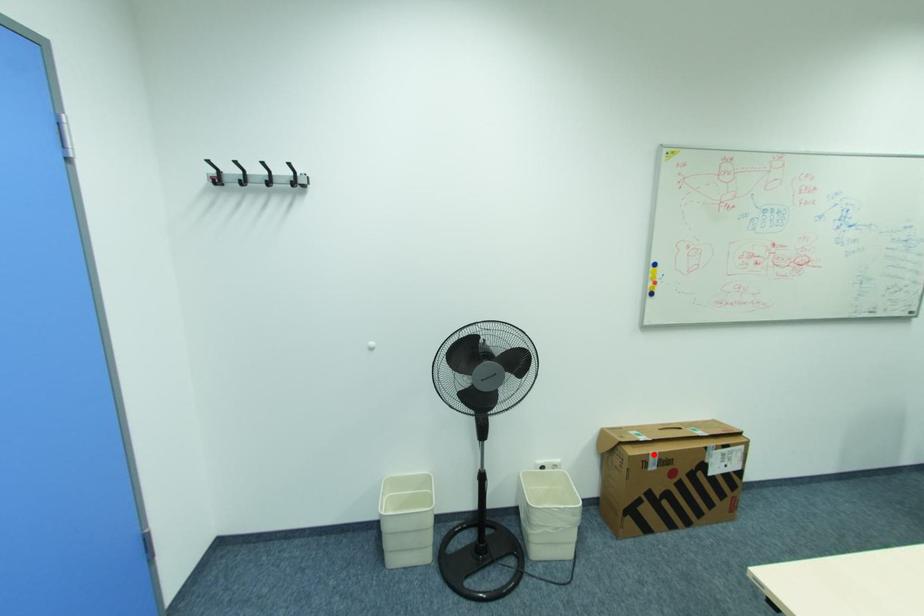
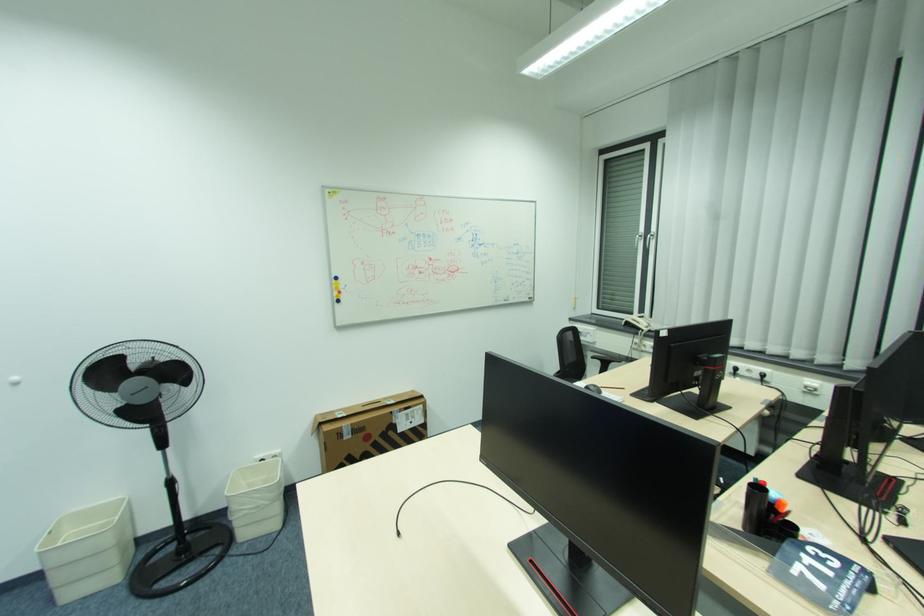
The point at the highlighted location is marked in the first image. Where is the corresponding point in the second image?

(346, 427)